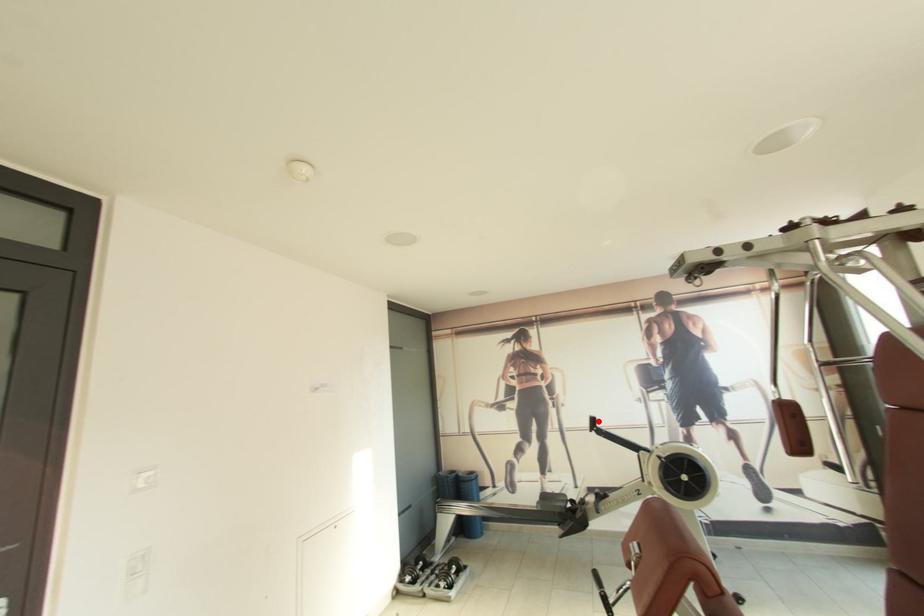
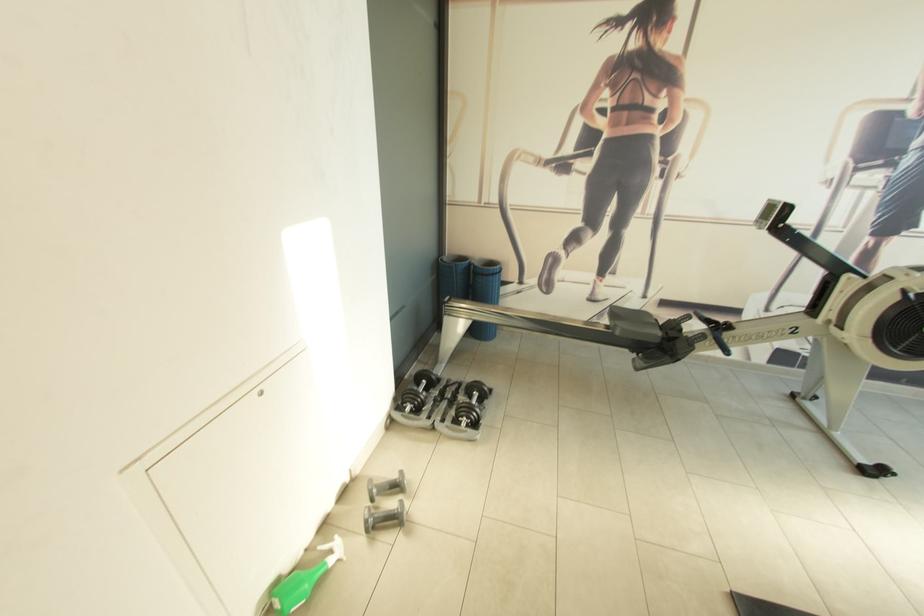
Where in the second image is the point corresponding to the highlighted location from the first image?

(792, 209)